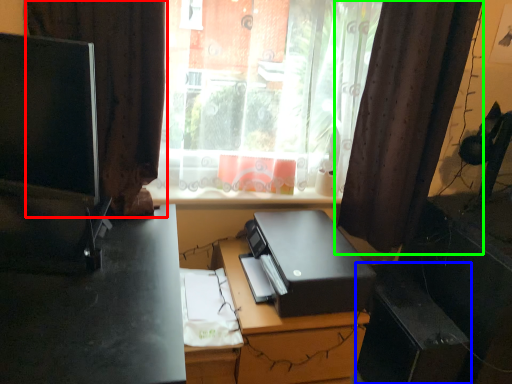
Question: Which is farther away from curtain (highlighted by a red box)? file cabinet (highlighted by a blue box) or curtain (highlighted by a green box)?

Choices:
 (A) file cabinet
 (B) curtain

Answer: (A)